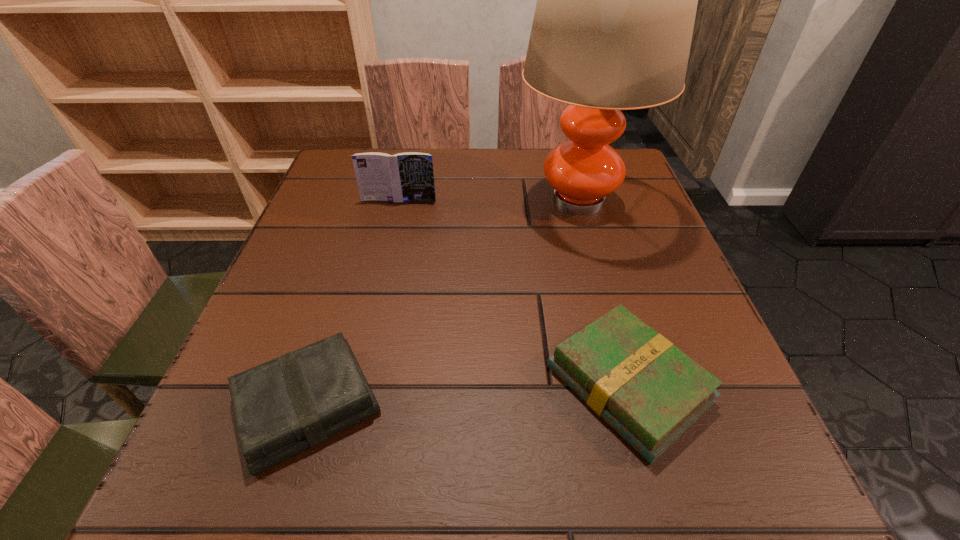
Where is `free location at the near right corner`? free location at the near right corner is located at coordinates (708, 484).

Locate an element on the screen. The width and height of the screenshot is (960, 540). unoccupied position between the rightmost book and the farthest book is located at coordinates (514, 292).

The height and width of the screenshot is (540, 960). I want to click on free area in between the farthest book and the rightmost book, so click(514, 292).

Find the location of a particular element. The image size is (960, 540). free spot between the tallest object and the farthest book is located at coordinates (489, 200).

Image resolution: width=960 pixels, height=540 pixels. Identify the location of free space between the rightmost book and the farthest book. (514, 292).

Find the location of a particular element. object that stands as the third closest to the rightmost book is located at coordinates (408, 176).

Identify which object is located as the second nearest to the tallest object. Please provide its 2D coordinates. Your answer should be formatted as a tuple, i.e. [(x, y)], where the tuple contains the x and y coordinates of a point satisfying the conditions above.

[(650, 392)]

Where is `book that is the closest to the tallest object`? The height and width of the screenshot is (540, 960). book that is the closest to the tallest object is located at coordinates (408, 176).

Identify the location of book object that ranks as the closest to the farthest book. (282, 407).

What are the coordinates of `free space that satisfies the following two spatial constraints: 1. on the front cover of the tallest book; 2. on the right side of the rightmost book` in the screenshot? It's located at (356, 384).